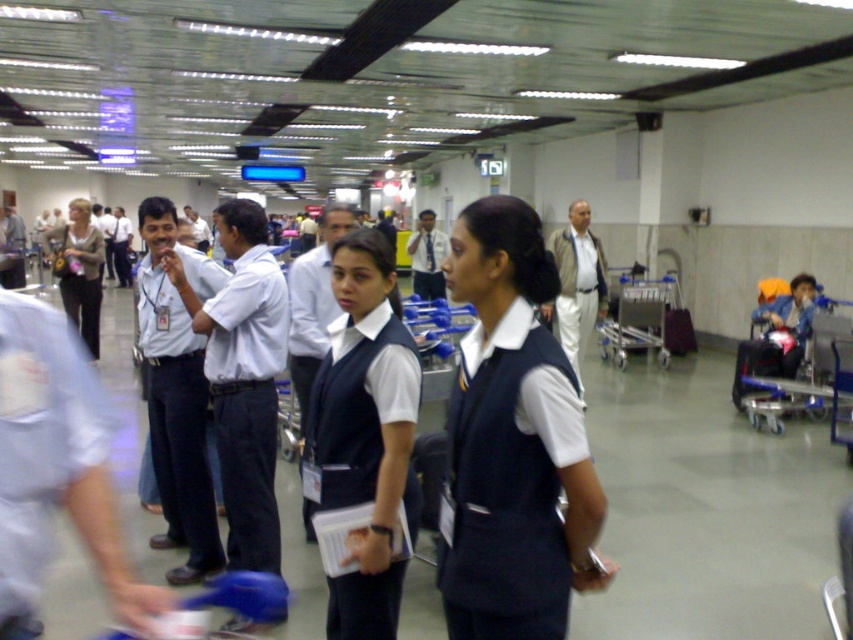
You are a security guard in the airport terminal. You need to check the credentials of two people in the image. One is wearing a light blue fabric shirt at left and the other is wearing a white fabric vest at center. According to the airport security protocol, which person is lower in position and should be checked first?

The light blue fabric shirt at left is below the white fabric vest at center, so the person wearing the light blue fabric shirt at left is lower in position and should be checked first.

Based on the scene description, where is the white fabric shirt at center located in terms of coordinates?

The white fabric shirt at center is located at coordinates point (247, 400).

You are an airport staff member observing two passengers in the terminal. You notice a white fabric shirt at center and a matte gray sweater at left. Which clothing item is smaller in size?

The white fabric shirt at center is smaller than the matte gray sweater at left.